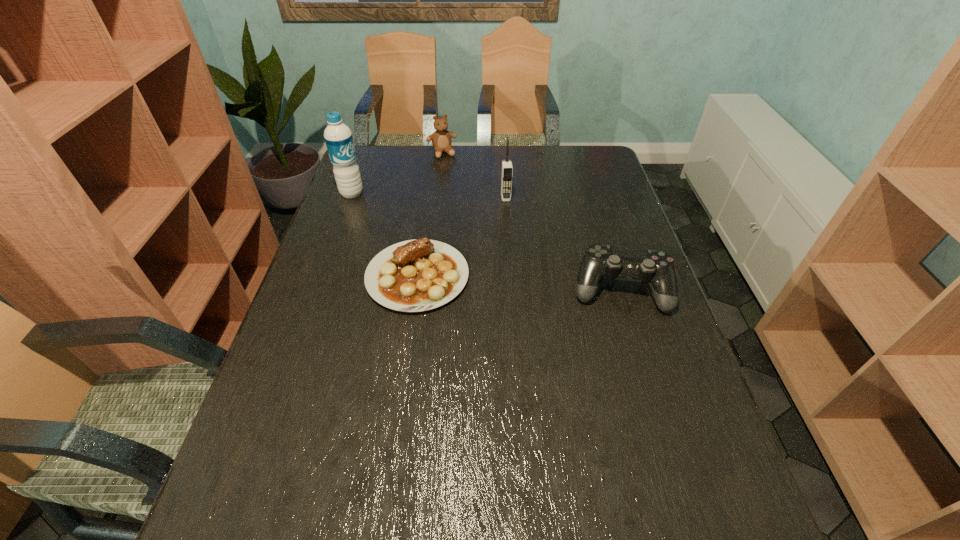
Locate an element on the screen. The width and height of the screenshot is (960, 540). vacant space on the desktop that is between the steak and the fourth tallest object and is positioned on the label of the water bottle is located at coordinates (498, 281).

Where is `free spot on the desktop that is between the steak and the second shortest object and is positioned on the front-facing side of the third shortest object`? The width and height of the screenshot is (960, 540). free spot on the desktop that is between the steak and the second shortest object and is positioned on the front-facing side of the third shortest object is located at coordinates (501, 282).

This screenshot has width=960, height=540. What are the coordinates of `vacant space on the desktop that is between the shortest object and the second shortest object and is positioned on the front-facing side of the cellular telephone` in the screenshot? It's located at (519, 283).